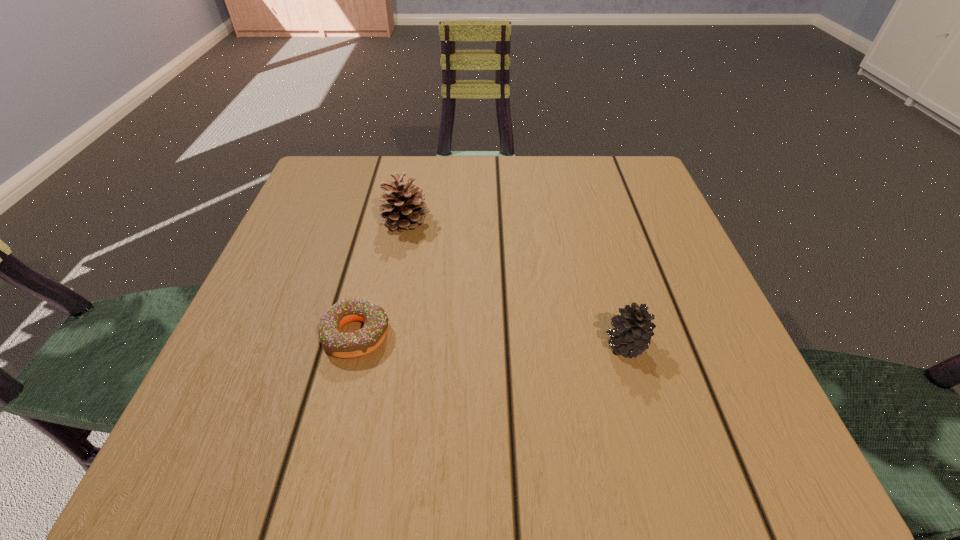
Find the location of a particular element. The image size is (960, 540). object present at the right edge is located at coordinates (633, 330).

Where is `free space at the far edge of the desktop`? free space at the far edge of the desktop is located at coordinates (457, 170).

Where is `free space at the near edge of the desktop`? The image size is (960, 540). free space at the near edge of the desktop is located at coordinates (506, 472).

Find the location of a particular element. vacant space at the left edge of the desktop is located at coordinates (257, 296).

Where is `vacant area at the right edge`? This screenshot has height=540, width=960. vacant area at the right edge is located at coordinates (693, 366).

Find the location of `vacant region at the far left corner of the desktop`. vacant region at the far left corner of the desktop is located at coordinates (328, 206).

In the image, there is a desktop. Identify the location of free space at the near left corner. (247, 448).

In the image, there is a desktop. Identify the location of vacant space at the far right corner. (645, 206).

Identify the location of free space that is in between the second shortest object and the shortest object. (492, 339).

Where is `unoccupied area between the rightmost object and the farthest object`? unoccupied area between the rightmost object and the farthest object is located at coordinates (516, 282).